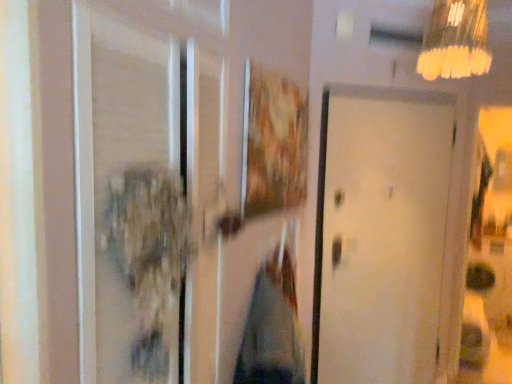
Question: Is transparent glass screen door at left in front of or behind white matte door at center in the image?

Choices:
 (A) front
 (B) behind

Answer: (A)

Question: Do you think transparent glass screen door at left is within white matte door at center, or outside of it?

Choices:
 (A) inside
 (B) outside

Answer: (B)

Question: Which object is the closest to the wooden textured picture frame at center?

Choices:
 (A) white matte door at center
 (B) transparent glass screen door at left
 (C) yellow frosted glass lampshade at upper right

Answer: (B)

Question: Estimate the real-world distances between objects in this image. Which object is farther from the transparent glass screen door at left?

Choices:
 (A) wooden textured picture frame at center
 (B) white matte door at center
 (C) yellow frosted glass lampshade at upper right

Answer: (B)